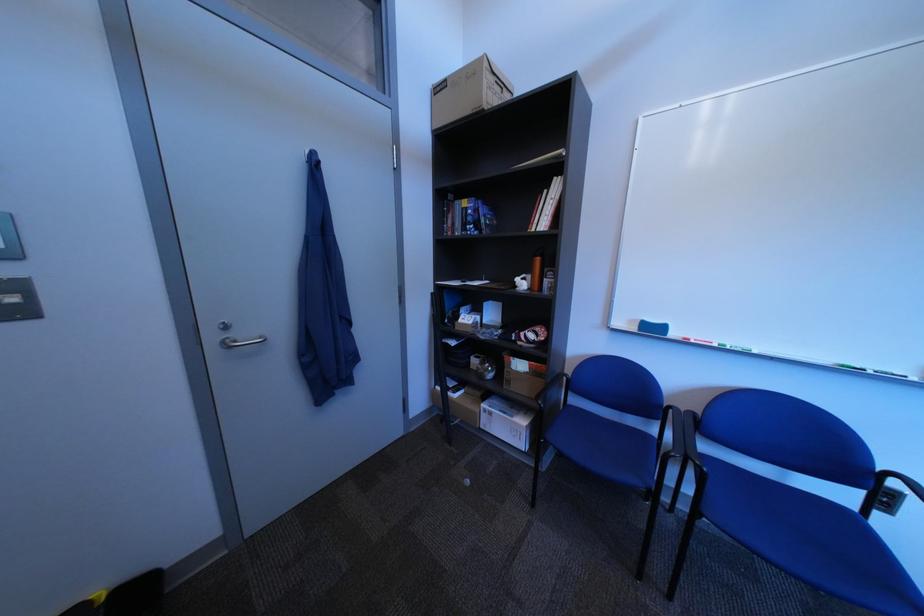
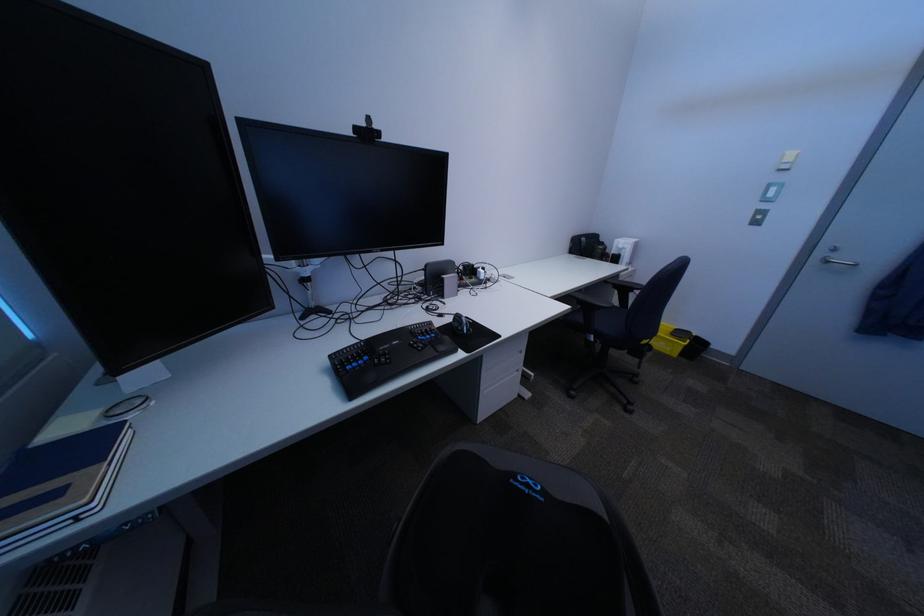
In the second image, find the point that corresponds to the point at 226,339 in the first image.

(834, 254)